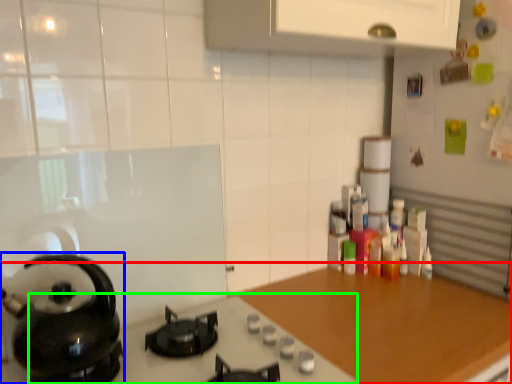
Question: Considering the real-world distances, which object is closest to countertop (highlighted by a red box)? kitchen appliance (highlighted by a blue box) or gas stove (highlighted by a green box).

Choices:
 (A) kitchen appliance
 (B) gas stove

Answer: (B)